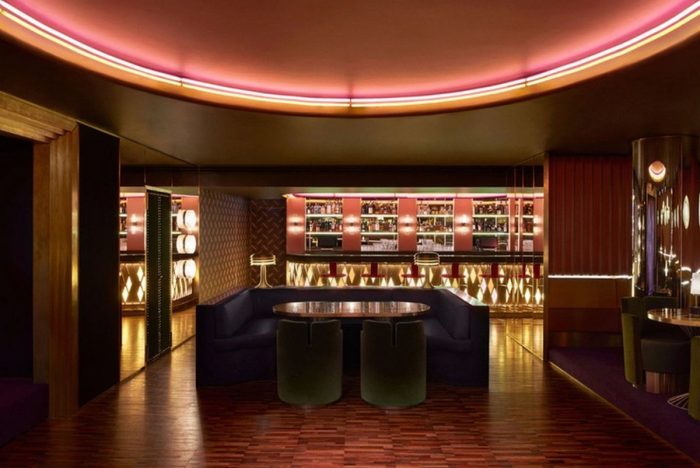
Identify the location of center blue couch. (344, 290).